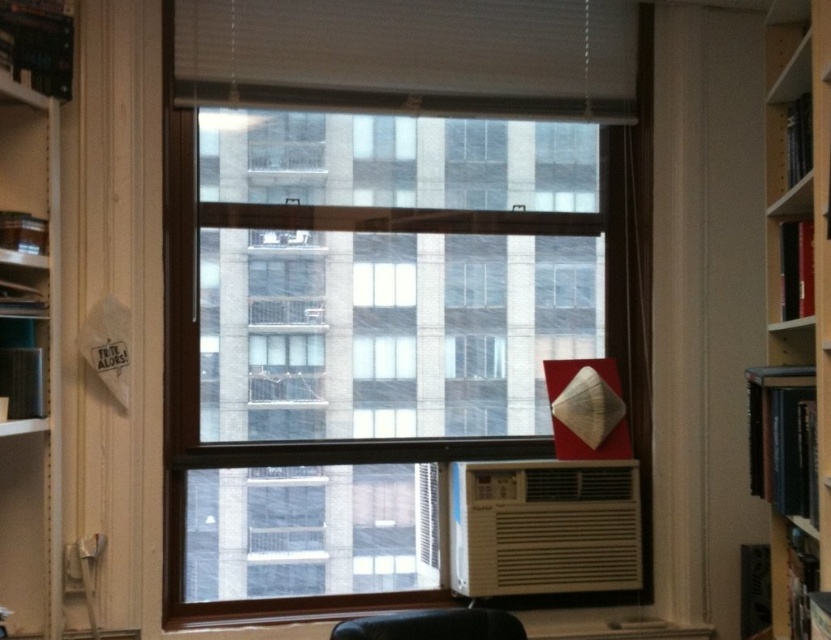
Does wooden bookshelf at right have a greater width compared to white plastic air conditioner at lower center?

No, wooden bookshelf at right is not wider than white plastic air conditioner at lower center.

Which of these two, wooden bookshelf at right or white plastic air conditioner at lower center, stands taller?

wooden bookshelf at right is taller.

This screenshot has width=831, height=640. What do you see at coordinates (798, 256) in the screenshot?
I see `wooden bookshelf at right` at bounding box center [798, 256].

Identify the location of wooden bookshelf at right. click(x=798, y=256).

Is wooden bookshelf at right below black leather armchair at lower center?

Incorrect, wooden bookshelf at right is not positioned below black leather armchair at lower center.

Between point (829, 556) and point (509, 620), which one is positioned in front?

Point (829, 556) is more forward.

I want to click on wooden bookshelf at right, so (x=798, y=256).

Does point (382, 61) lie in front of point (23, 406)?

No.

Is point (271, 10) farther from camera compared to point (32, 186)?

Yes, it is.

You are a GUI agent. You are given a task and a screenshot of the screen. Output one action in this format:
    pyautogui.click(x=<x>, y=<y>)
    Task: Click on the transparent glass window at center
    
    Given the screenshot: What is the action you would take?
    pyautogui.click(x=381, y=292)